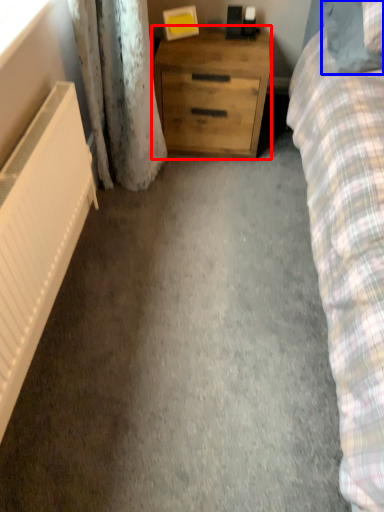
Question: Which object is further to the camera taking this photo, chest of drawers (highlighted by a red box) or pillow (highlighted by a blue box)?

Choices:
 (A) chest of drawers
 (B) pillow

Answer: (A)